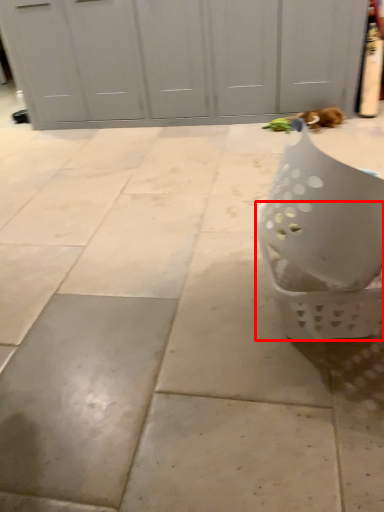
Question: From the image's perspective, where is basket (annotated by the red box) located relative to cat?

Choices:
 (A) above
 (B) below

Answer: (B)